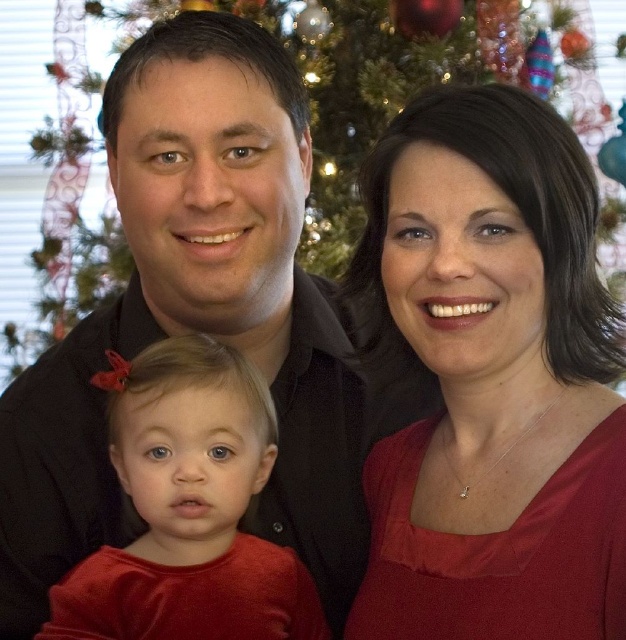
You are a photographer setting up a tripod to take a photo of the family. The shiny red dress at lower left and the green textured christmas tree at center are both in the frame. Which object is closer to the ground?

The shiny red dress at lower left is shorter than the green textured christmas tree at center, so it is closer to the ground.

You are standing in front of the Christmas tree and want to place a gift box at point (x=485, y=326) and another gift box at point (x=31, y=424). Which gift box will appear larger to you?

The gift box placed at point (x=485, y=326) will appear larger because it is closer to the viewer than the one at point (x=31, y=424).

You are a photographer adjusting the lighting for a family photo. The scene has a matte red dress at center and a matte black shirt at center. Which object should you focus on first to ensure proper exposure, the one higher up or the one lower down?

The matte red dress at center is located below the matte black shirt at center, so you should focus on the matte black shirt at center first as it is higher up.